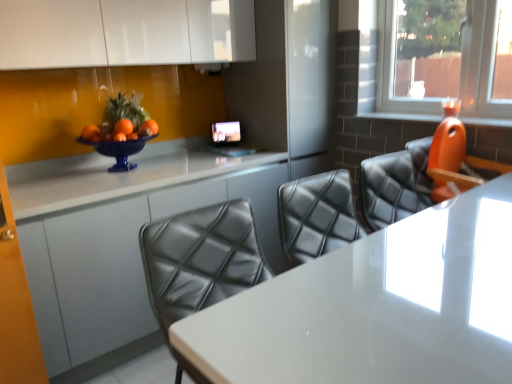
Question: Does orange plastic chair at right lie behind white glossy counter at center?

Choices:
 (A) no
 (B) yes

Answer: (A)

Question: Is orange plastic chair at right thinner than white glossy counter at center?

Choices:
 (A) yes
 (B) no

Answer: (A)

Question: Does orange plastic chair at right appear on the right side of white glossy counter at center?

Choices:
 (A) no
 (B) yes

Answer: (B)

Question: Does orange plastic chair at right have a larger size compared to white glossy counter at center?

Choices:
 (A) no
 (B) yes

Answer: (A)

Question: Considering the relative sizes of orange plastic chair at right and white glossy counter at center in the image provided, is orange plastic chair at right smaller than white glossy counter at center?

Choices:
 (A) yes
 (B) no

Answer: (A)

Question: From a real-world perspective, is orange plastic chair at right physically above white glossy counter at center?

Choices:
 (A) yes
 (B) no

Answer: (A)

Question: Is transparent glass candle at upper right wider than orange plastic chair at right?

Choices:
 (A) no
 (B) yes

Answer: (A)

Question: Is there a large distance between transparent glass candle at upper right and orange plastic chair at right?

Choices:
 (A) yes
 (B) no

Answer: (B)

Question: Is orange plastic chair at right at the back of transparent glass candle at upper right?

Choices:
 (A) no
 (B) yes

Answer: (A)

Question: From the image's perspective, would you say transparent glass candle at upper right is shown under orange plastic chair at right?

Choices:
 (A) no
 (B) yes

Answer: (A)

Question: Could you tell me if transparent glass candle at upper right is turned towards orange plastic chair at right?

Choices:
 (A) no
 (B) yes

Answer: (B)

Question: Does transparent glass candle at upper right have a greater height compared to orange plastic chair at right?

Choices:
 (A) no
 (B) yes

Answer: (B)

Question: Is transparent glass candle at upper right a part of white glossy table at center?

Choices:
 (A) no
 (B) yes

Answer: (A)